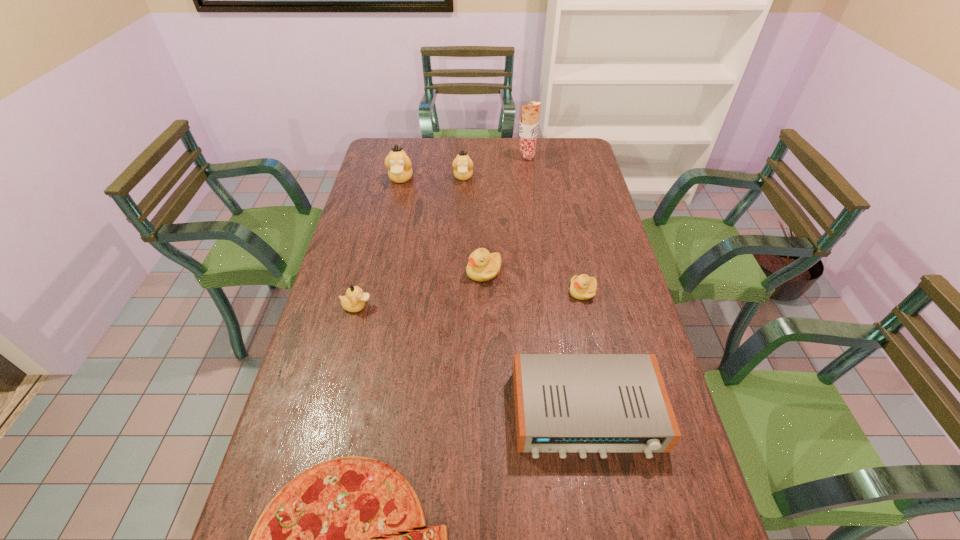
At what (x,y) coordinates should I click in order to perform the action: click on free space between the left yellow duckling and the second smallest tan duckling. Please return your answer as a coordinate pair (x, y). The height and width of the screenshot is (540, 960). Looking at the image, I should click on (473, 224).

At what (x,y) coordinates should I click in order to perform the action: click on free spot between the farthest object and the second biggest tan duckling. Please return your answer as a coordinate pair (x, y). This screenshot has height=540, width=960. Looking at the image, I should click on (495, 167).

I want to click on empty space between the left yellow duckling and the seventh tallest object, so click(533, 281).

Locate an element on the screen. This screenshot has height=540, width=960. vacant point located between the burrito and the smallest tan duckling is located at coordinates (442, 232).

Locate an element on the screen. The width and height of the screenshot is (960, 540). free space between the fourth shortest duckling and the farthest object is located at coordinates (495, 167).

Locate an element on the screen. The width and height of the screenshot is (960, 540). empty space between the tallest object and the left yellow duckling is located at coordinates (505, 214).

At what (x,y) coordinates should I click in order to perform the action: click on free spot between the radio receiver and the smallest tan duckling. Please return your answer as a coordinate pair (x, y). Looking at the image, I should click on (472, 360).

Find the location of a particular element. The width and height of the screenshot is (960, 540). the second closest object to the right yellow duckling is located at coordinates (582, 403).

Where is `object that stands as the third closest to the sixth shortest object`? This screenshot has width=960, height=540. object that stands as the third closest to the sixth shortest object is located at coordinates (482, 266).

Locate an element on the screen. This screenshot has width=960, height=540. duckling that is the second closest one to the right yellow duckling is located at coordinates (354, 301).